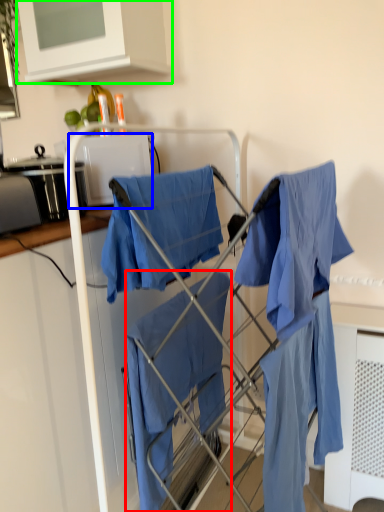
Question: Based on their relative distances, which object is nearer to cloak (highlighted by a red box)? Choose from appliance (highlighted by a blue box) and cabinetry (highlighted by a green box).

Choices:
 (A) appliance
 (B) cabinetry

Answer: (A)